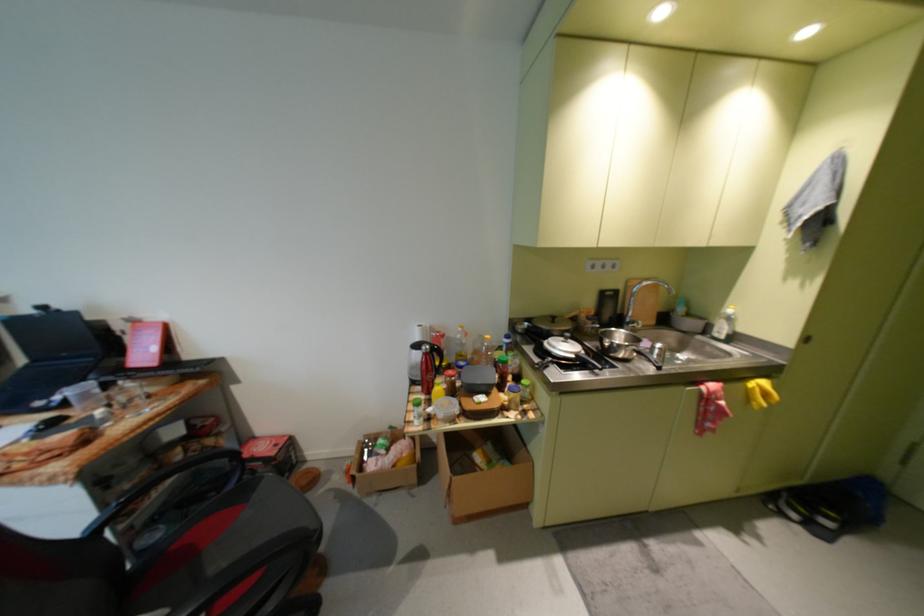
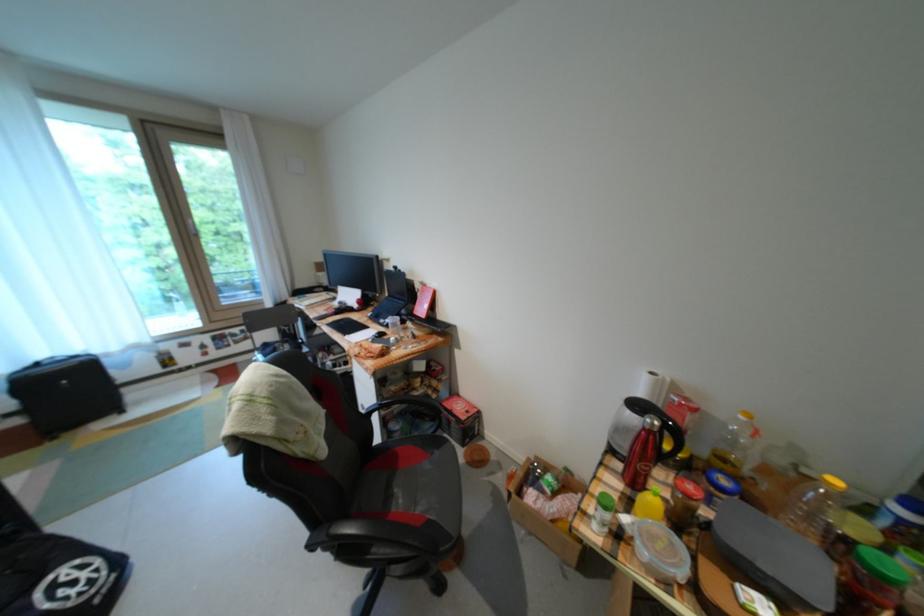
The point at [495,349] is marked in the first image. Where is the corresponding point in the second image?

(821, 495)